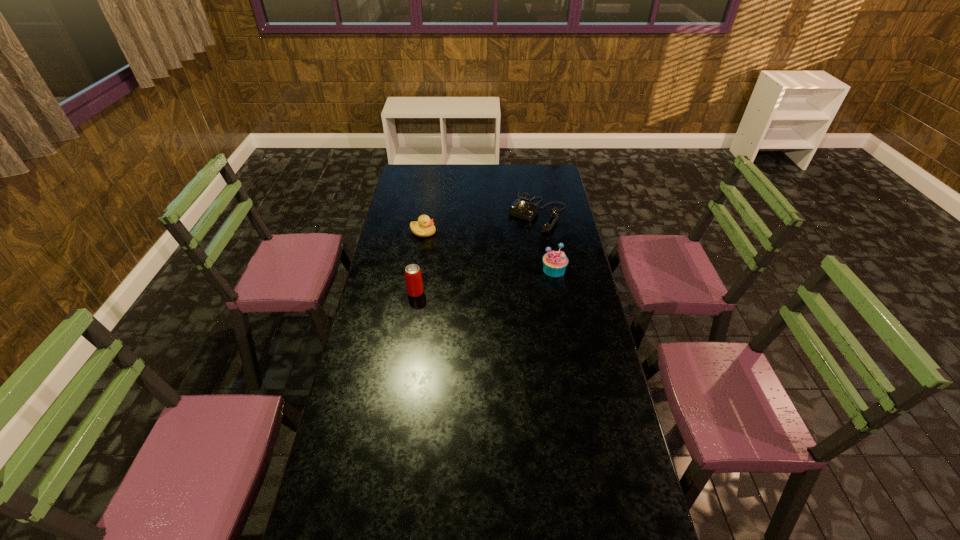
The width and height of the screenshot is (960, 540). What are the coordinates of `vacant space at the near right corner` in the screenshot? It's located at (611, 516).

You are a GUI agent. You are given a task and a screenshot of the screen. Output one action in this format:
    pyautogui.click(x=<x>, y=<y>)
    Task: Click on the unoccupied area between the telephone and the duckling
    
    Given the screenshot: What is the action you would take?
    pyautogui.click(x=480, y=222)

You are a GUI agent. You are given a task and a screenshot of the screen. Output one action in this format:
    pyautogui.click(x=<x>, y=<y>)
    Task: Click on the empty space between the beer can and the telephone
    
    Given the screenshot: What is the action you would take?
    pyautogui.click(x=476, y=253)

This screenshot has height=540, width=960. What are the coordinates of `free space between the muffin and the duckling` in the screenshot? It's located at (489, 251).

Find the location of a particular element. free space that is in between the second nearest object and the duckling is located at coordinates (489, 251).

The height and width of the screenshot is (540, 960). Find the location of `vacant region between the nearest object and the muffin`. vacant region between the nearest object and the muffin is located at coordinates (485, 281).

Find the location of `free space between the duckling and the second nearest object`. free space between the duckling and the second nearest object is located at coordinates (489, 251).

The height and width of the screenshot is (540, 960). Identify the location of free space between the telephone and the muffin. (546, 241).

Locate an element on the screen. free area in between the duckling and the telephone is located at coordinates (480, 222).

This screenshot has height=540, width=960. I want to click on vacant area between the duckling and the beer can, so click(420, 262).